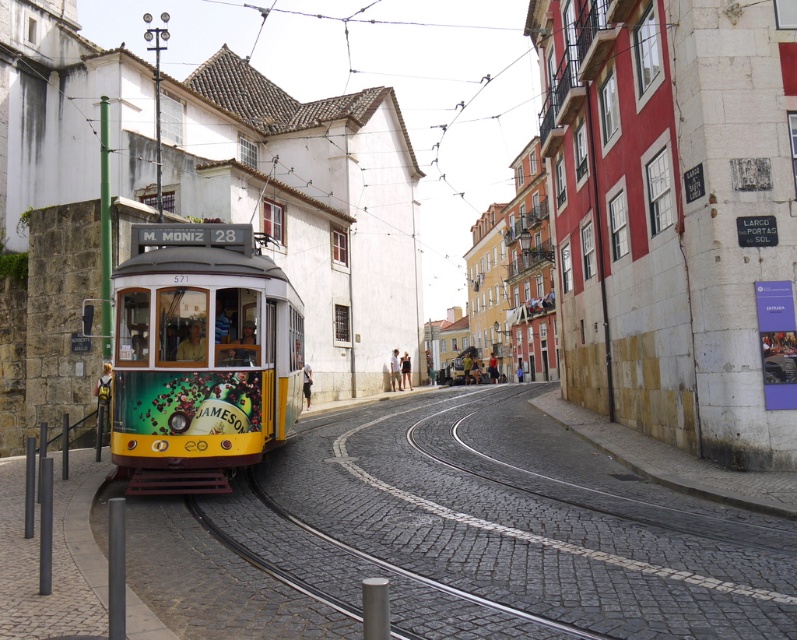
Question: Can you confirm if yellow rubber track at lower left is thinner than yellow polished metal tram at left?

Choices:
 (A) yes
 (B) no

Answer: (B)

Question: Can you confirm if yellow rubber track at lower left is bigger than yellow polished metal tram at left?

Choices:
 (A) yes
 (B) no

Answer: (A)

Question: Considering the relative positions of yellow rubber track at lower left and yellow polished metal tram at left in the image provided, where is yellow rubber track at lower left located with respect to yellow polished metal tram at left?

Choices:
 (A) above
 (B) below

Answer: (B)

Question: Which of the following is the closest to the observer?

Choices:
 (A) (383, 472)
 (B) (210, 285)

Answer: (B)